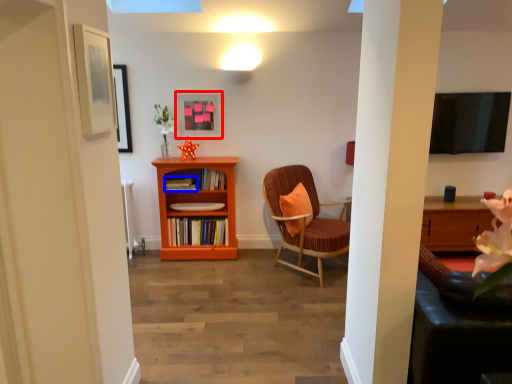
Question: Among these objects, which one is farthest to the camera, picture frame (highlighted by a red box) or book (highlighted by a blue box)?

Choices:
 (A) picture frame
 (B) book

Answer: (A)